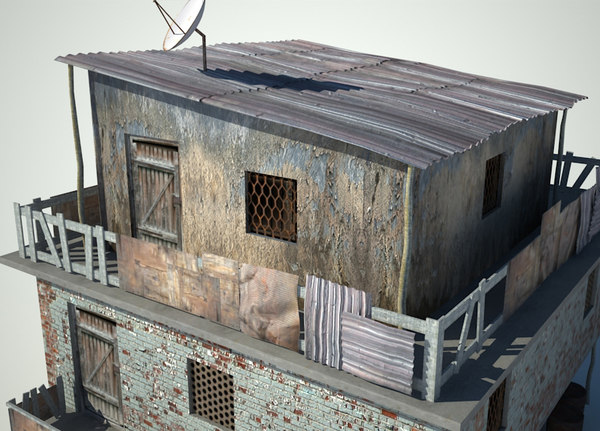
This screenshot has width=600, height=431. I want to click on wall, so click(299, 412).